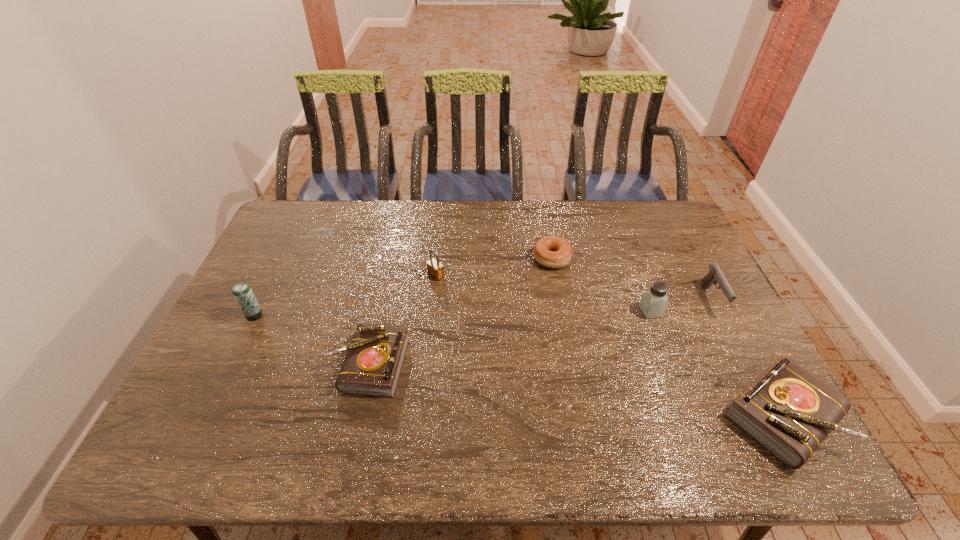
This screenshot has width=960, height=540. Identify the location of blank region between the saltshaker and the fourth object from left to right. (x=601, y=285).

Locate an element on the screen. unoccupied area between the pistol and the right diary is located at coordinates (747, 357).

Image resolution: width=960 pixels, height=540 pixels. In order to click on free area in between the saltshaker and the leftmost object in this screenshot , I will do `click(452, 314)`.

Where is `empty location between the beer can and the right diary`? The height and width of the screenshot is (540, 960). empty location between the beer can and the right diary is located at coordinates (518, 366).

Find the location of a particular element. The image size is (960, 540). free point between the padlock and the pistol is located at coordinates (573, 287).

This screenshot has height=540, width=960. I want to click on empty space that is in between the beer can and the third shortest object, so click(518, 366).

At what (x,y) coordinates should I click in order to perform the action: click on empty space between the saltshaker and the pistol. Please return your answer as a coordinate pair (x, y). Looking at the image, I should click on (681, 306).

Where is `vacant area that lies between the left diary and the fifth object from right to left`? This screenshot has height=540, width=960. vacant area that lies between the left diary and the fifth object from right to left is located at coordinates pos(401,320).

Select which object appears as the fourth closest to the third object from left to right. Please provide its 2D coordinates. Your answer should be formatted as a tuple, i.e. [(x, y)], where the tuple contains the x and y coordinates of a point satisfying the conditions above.

[(654, 301)]

What are the coordinates of `the second closest object relative to the saltshaker` in the screenshot? It's located at (789, 411).